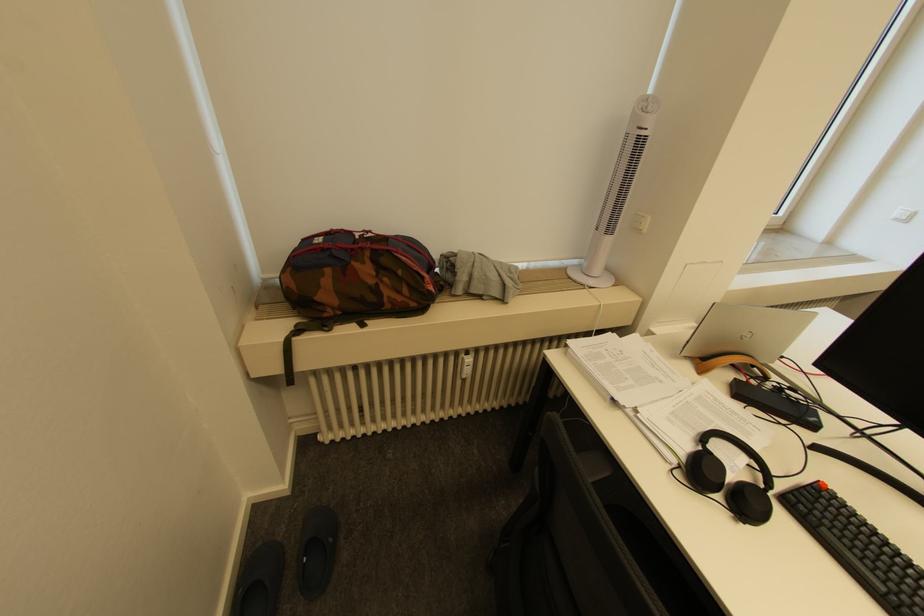
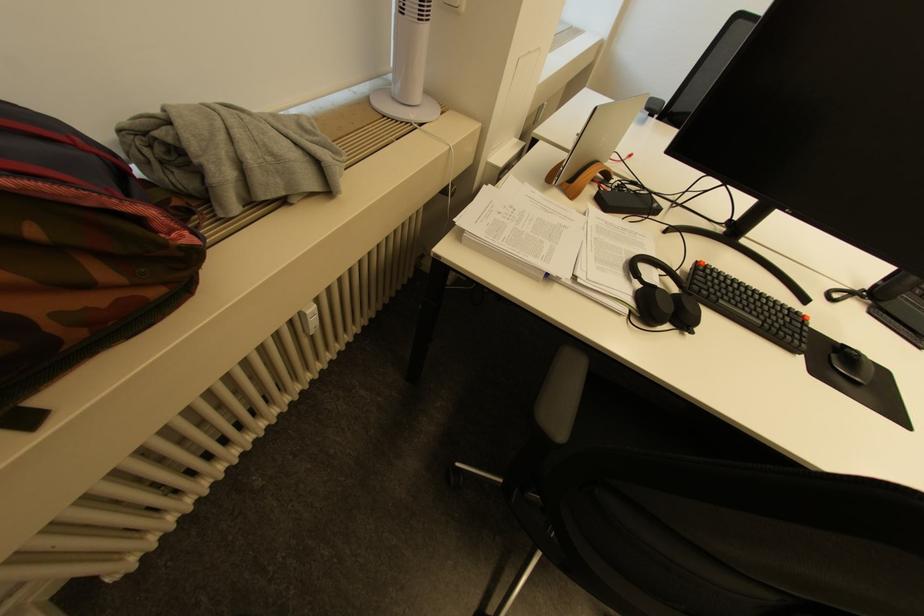
The point at (686, 464) is marked in the first image. Where is the corresponding point in the second image?

(637, 312)